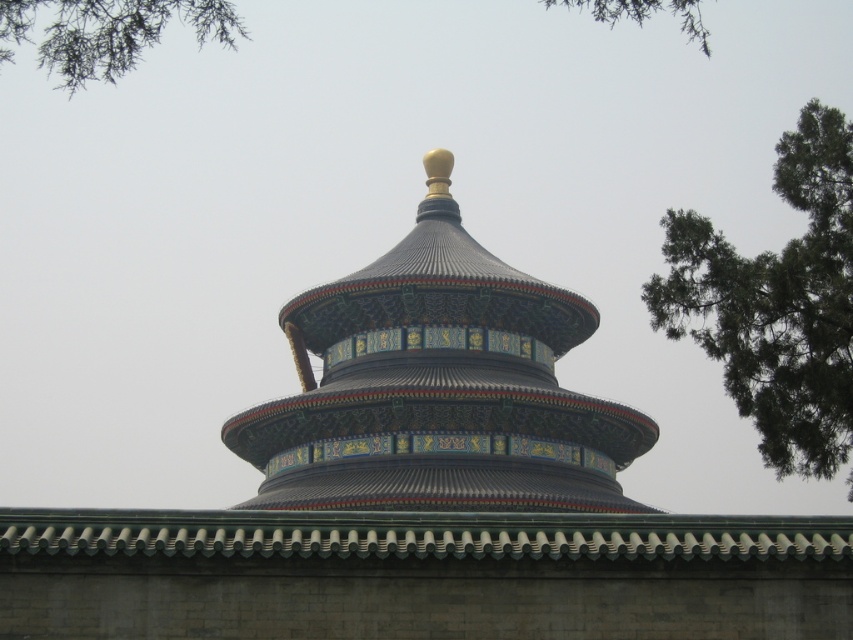
You are standing at the Temple of Heaven in Beijing and want to take a photo of the golden ball on the roof. The point where you are standing is at coordinates point (828, 275). Given that you are 158.12 feet away from this point, can you estimate whether you can capture the golden ball in your photo without moving closer?

The point (828, 275) is 158.12 feet away from the viewer. Since the golden ball is located atop the roof of the Temple of Heaven, which is the focal point, it is likely visible from that distance. However, the exact visibility depends on the camera lens and angle, but based on the provided distance, capturing the golden ball should be possible without moving closer.

You are standing at the Temple of Heaven in Beijing and want to take a photo of the iconic circular roof. The Temple of Heaven has a gray brick exterior and a multi layered roof with colors from dark green to black. There is a point labeled as point (x=418, y=433). If you are 75.69 meters away from this point, will you be able to capture the entire roof in your photo?

The distance between you and point (x=418, y=433) is 75.69 meters. Since the point is on the roof, being that far away might make it challenging to capture the entire roof in a single photo without zooming, but it depends on your camera lens. However, the question specifies the distance to the point, not the entire structure. To ensure the entire roof is in frame, you might need to adjust your position or use a wide angle lens.

You are standing at the entrance of the Temple of Heaven and want to take a photo of the iconic circular roof without any obstructions. There is a green leafy tree at upper left in the scene. Based on its position, will the tree block your view of the roof?

The green leafy tree at upper left is located at point (105, 33), which is at the upper left corner of the scene. Since the circular roof is the focal point in the center, the tree is positioned away from the main structure and unlikely to obstruct the view of the roof.